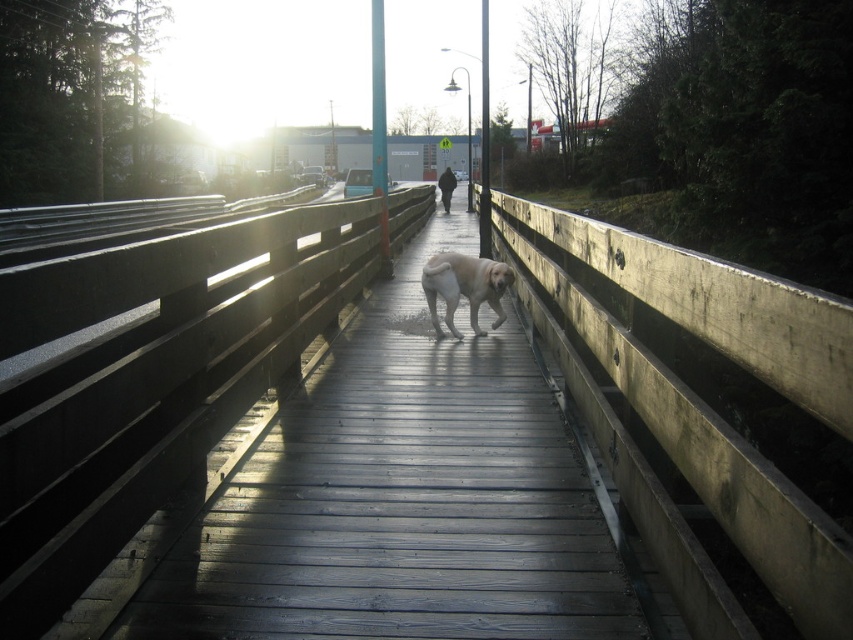
Question: Can you confirm if wooden bridge at center is positioned to the right of golden fur dog at center?

Choices:
 (A) no
 (B) yes

Answer: (A)

Question: Where is wooden bridge at center located in relation to golden fur dog at center in the image?

Choices:
 (A) below
 (B) above

Answer: (A)

Question: Is wooden bridge at center positioned at the back of golden fur dog at center?

Choices:
 (A) no
 (B) yes

Answer: (A)